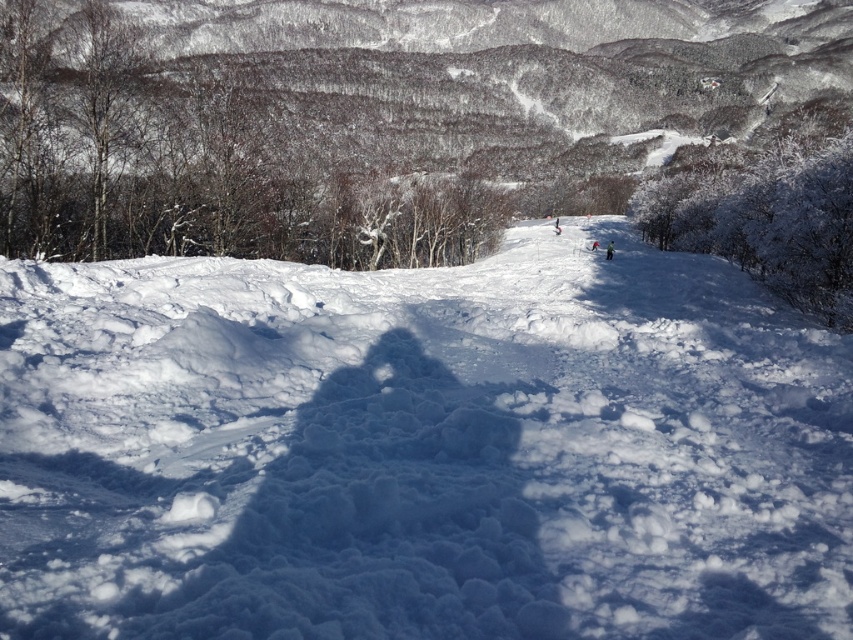
You are a photographer trying to capture a clear shot of both the white fluffy snow at center and the white matte ski at center. Since you want both objects in focus, which one should you adjust your camera focus on first?

You should focus on the white fluffy snow at center first because it is closer to the viewer than the white matte ski at center, ensuring depth of field covers both objects.

You are a skier who just arrived at the slope and see the white fluffy snow at center and the white matte ski at center. Which one is wider?

The white fluffy snow at center is wider than the white matte ski at center.

You are standing at the base of the slope and want to reach the top. You see two points marked on the slope, point (352, 500) and point (595, 243). Which point should you aim for first if you want to take the shortest path to the top?

You should aim for point (352, 500) first because it is closer to you than point (595, 243), so it requires less effort to reach initially.